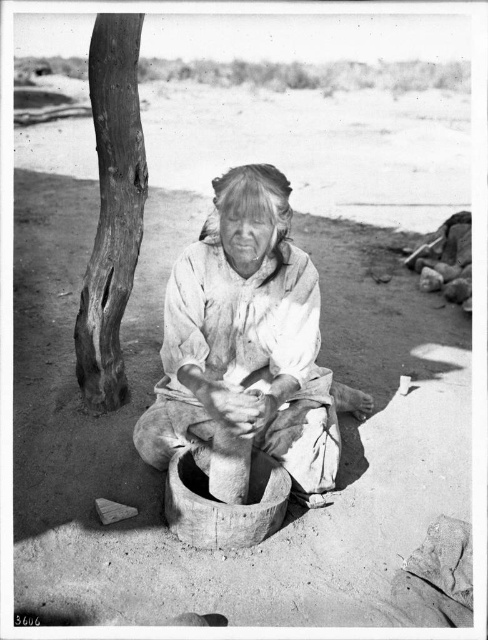
Looking at this image, based on the scene described, which object is wider when comparing the white clothed woman at center and the smooth bark tree trunk at left?

The white clothed woman at center is wider than the smooth bark tree trunk at left according to the description.

You are a photographer standing in front of the scene. You want to take a photo of the white clothed woman at center and the smooth bark tree trunk at left. Which object is positioned closer to you?

The white clothed woman at center is closer to the viewer than the smooth bark tree trunk at left, so the white clothed woman at center is positioned closer to you.